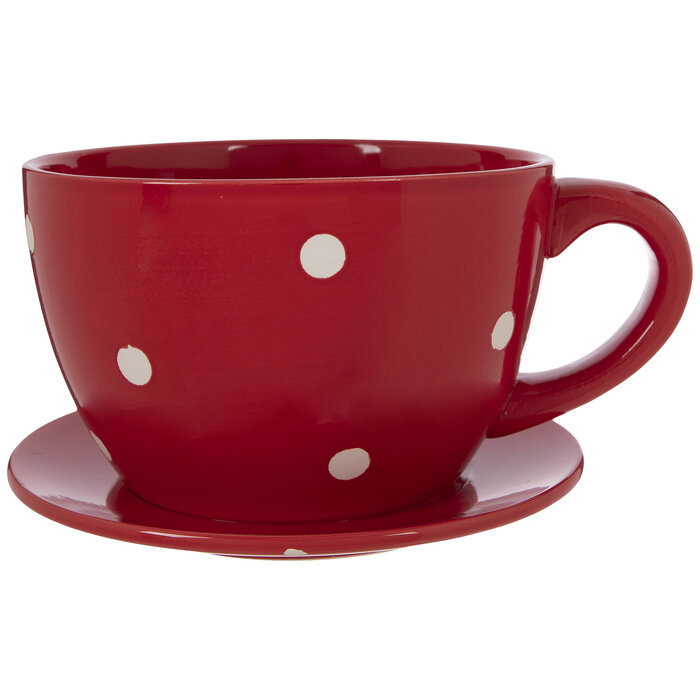
I want to click on saucer, so click(301, 533).